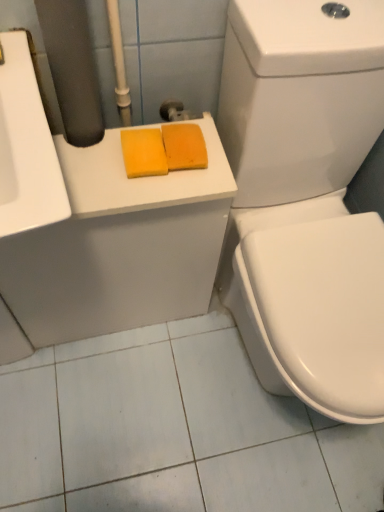
The image size is (384, 512). Find the location of `yellow sponge at upper left`. yellow sponge at upper left is located at coordinates (119, 246).

Measure the distance between point (156, 175) and camera.

A distance of 79.60 centimeters exists between point (156, 175) and camera.

From the picture: How much space does orange sponge at upper center, acting as the second soap starting from the left, occupy vertically?

The height of orange sponge at upper center, acting as the second soap starting from the left, is 1.63 inches.

This screenshot has width=384, height=512. In order to click on yellow sponge at upper left in this screenshot , I will do `click(119, 246)`.

Is orange sponge at upper center, which appears as the first soap when viewed from the right, wider than yellow sponge at upper left?

In fact, orange sponge at upper center, which appears as the first soap when viewed from the right, might be narrower than yellow sponge at upper left.

Considering the sizes of objects orange sponge at upper center, acting as the second soap starting from the left, and yellow sponge at upper left in the image provided, who is smaller, orange sponge at upper center, acting as the second soap starting from the left, or yellow sponge at upper left?

orange sponge at upper center, acting as the second soap starting from the left.

Is the position of orange sponge at upper center, acting as the second soap starting from the left, more distant than that of yellow sponge at upper left?

Yes, it is.

Is point (202, 149) closer or farther from the camera than point (68, 178)?

Point (202, 149) is farther from the camera than point (68, 178).

Is white glossy toilet at right oriented away from yellow sponge at center, which is the first soap in left-to-right order?

That's not correct — white glossy toilet at right is not looking away from yellow sponge at center, which is the first soap in left-to-right order.

Is point (373, 135) less distant than point (143, 155)?

No, (373, 135) is behind (143, 155).

Is white glossy toilet at right not within yellow sponge at center, the 2th soap in the right-to-left sequence?

Yes, white glossy toilet at right is located beyond the bounds of yellow sponge at center, the 2th soap in the right-to-left sequence.

Considering the sizes of objects white glossy toilet at right and yellow sponge at center, which is the first soap in left-to-right order, in the image provided, who is taller, white glossy toilet at right or yellow sponge at center, which is the first soap in left-to-right order,?

white glossy toilet at right.

Considering the positions of points (214, 241) and (166, 131), is point (214, 241) closer to camera compared to point (166, 131)?

No.

Does yellow sponge at upper left have a lesser width compared to orange sponge at upper center, acting as the second soap starting from the left?

No, yellow sponge at upper left is not thinner than orange sponge at upper center, acting as the second soap starting from the left.

Could orange sponge at upper center, acting as the second soap starting from the left, be considered to be inside yellow sponge at upper left?

That's incorrect, orange sponge at upper center, acting as the second soap starting from the left, is not inside yellow sponge at upper left.

Which of these two, yellow sponge at center, the 2th soap in the right-to-left sequence, or yellow sponge at upper left, stands taller?

yellow sponge at upper left is taller.

Measure the distance from yellow sponge at center, the 2th soap in the right-to-left sequence, to yellow sponge at upper left.

They are 12.14 inches apart.

Could you tell me if yellow sponge at center, which is the first soap in left-to-right order, is turned towards yellow sponge at upper left?

No, yellow sponge at center, which is the first soap in left-to-right order, is not oriented towards yellow sponge at upper left.

Which of these two, yellow sponge at center, the 2th soap in the right-to-left sequence, or orange sponge at upper center, acting as the second soap starting from the left, is smaller?

Smaller between the two is yellow sponge at center, the 2th soap in the right-to-left sequence.

Which of these two, yellow sponge at center, the 2th soap in the right-to-left sequence, or orange sponge at upper center, which appears as the first soap when viewed from the right, is thinner?

Thinner between the two is orange sponge at upper center, which appears as the first soap when viewed from the right.

From a real-world perspective, is yellow sponge at center, the 2th soap in the right-to-left sequence, positioned over orange sponge at upper center, acting as the second soap starting from the left, based on gravity?

Yes, from a real-world perspective, yellow sponge at center, the 2th soap in the right-to-left sequence, is on top of orange sponge at upper center, acting as the second soap starting from the left.

Which of these two, white glossy toilet at right or orange sponge at upper center, which appears as the first soap when viewed from the right, is thinner?

With smaller width is orange sponge at upper center, which appears as the first soap when viewed from the right.

From the image's perspective, who appears lower, white glossy toilet at right or orange sponge at upper center, which appears as the first soap when viewed from the right?

white glossy toilet at right is shown below in the image.

Would you say orange sponge at upper center, acting as the second soap starting from the left, is part of white glossy toilet at right's contents?

That's incorrect, orange sponge at upper center, acting as the second soap starting from the left, is not inside white glossy toilet at right.

Which soap is the 1st one when counting from the left side of the white glossy toilet at right? Please provide its 2D coordinates.

[(184, 146)]

From the image's perspective, is yellow sponge at upper left below white glossy toilet at right?

Incorrect, from the image's perspective, yellow sponge at upper left is higher than white glossy toilet at right.

Which is correct: yellow sponge at upper left is inside white glossy toilet at right, or outside of it?

yellow sponge at upper left exists outside the volume of white glossy toilet at right.

From a real-world perspective, which object stands above the other?

white glossy toilet at right is physically above.

Looking at this image, who is bigger, yellow sponge at upper left or white glossy toilet at right?

Bigger between the two is white glossy toilet at right.

I want to click on soap that is the 2nd one when counting upward from the yellow sponge at upper left (from the image's perspective), so pos(184,146).

Find the location of a particular element. toilet located on the right of yellow sponge at center, the 2th soap in the right-to-left sequence is located at coordinates (305, 199).

Based on their spatial positions, is orange sponge at upper center, which appears as the first soap when viewed from the right, or yellow sponge at upper left closer to white glossy toilet at right?

The object closer to white glossy toilet at right is yellow sponge at upper left.

Considering their positions, is yellow sponge at upper left positioned closer to white glossy toilet at right than orange sponge at upper center, acting as the second soap starting from the left?

yellow sponge at upper left is positioned closer to the anchor white glossy toilet at right.

From the image, which object appears to be farther from yellow sponge at upper left, white glossy toilet at right or yellow sponge at center, the 2th soap in the right-to-left sequence?

yellow sponge at center, the 2th soap in the right-to-left sequence, lies further to yellow sponge at upper left than the other object.

Estimate the real-world distances between objects in this image. Which object is further from white glossy toilet at right, yellow sponge at center, which is the first soap in left-to-right order, or orange sponge at upper center, acting as the second soap starting from the left?

The object further to white glossy toilet at right is yellow sponge at center, which is the first soap in left-to-right order.

Looking at the image, which one is located closer to yellow sponge at upper left, yellow sponge at center, the 2th soap in the right-to-left sequence, or white glossy toilet at right?

white glossy toilet at right.

Which object lies nearer to the anchor point orange sponge at upper center, acting as the second soap starting from the left, white glossy toilet at right or yellow sponge at center, the 2th soap in the right-to-left sequence?

yellow sponge at center, the 2th soap in the right-to-left sequence, lies closer to orange sponge at upper center, acting as the second soap starting from the left, than the other object.

Based on their spatial positions, is orange sponge at upper center, which appears as the first soap when viewed from the right, or white glossy toilet at right further from yellow sponge at upper left?

Among the two, orange sponge at upper center, which appears as the first soap when viewed from the right, is located further to yellow sponge at upper left.

Looking at the image, which one is located further to yellow sponge at center, which is the first soap in left-to-right order, white glossy toilet at right or orange sponge at upper center, which appears as the first soap when viewed from the right?

white glossy toilet at right is positioned further to the anchor yellow sponge at center, which is the first soap in left-to-right order.

You are a GUI agent. You are given a task and a screenshot of the screen. Output one action in this format:
    pyautogui.click(x=<x>, y=<y>)
    Task: Click on the soap between white glossy toilet at right and orange sponge at upper center, acting as the second soap starting from the left, along the z-axis
    This screenshot has height=512, width=384.
    Given the screenshot: What is the action you would take?
    pyautogui.click(x=144, y=152)

You are a GUI agent. You are given a task and a screenshot of the screen. Output one action in this format:
    pyautogui.click(x=<x>, y=<y>)
    Task: Click on the soap situated between yellow sponge at upper left and orange sponge at upper center, which appears as the first soap when viewed from the right, from left to right
    The width and height of the screenshot is (384, 512).
    Given the screenshot: What is the action you would take?
    pyautogui.click(x=144, y=152)